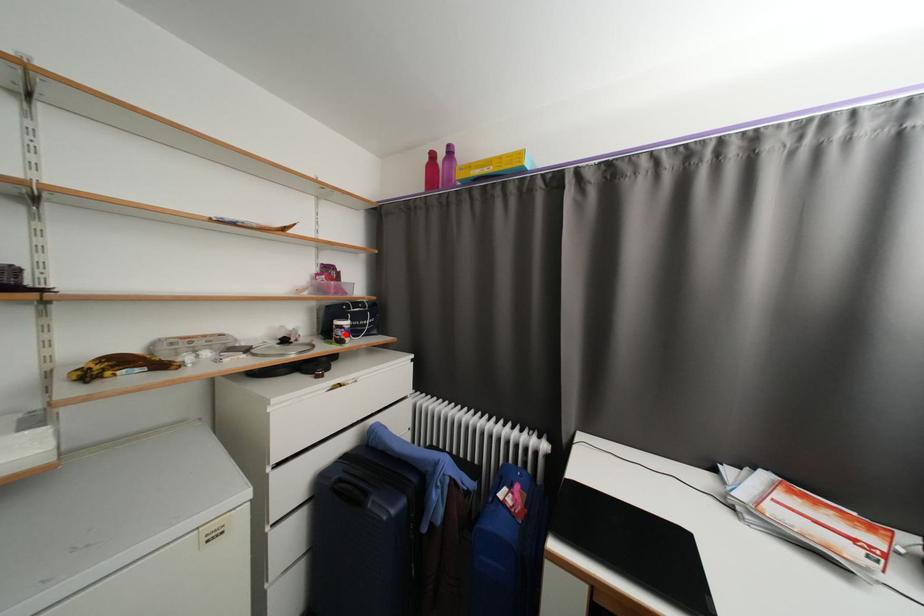
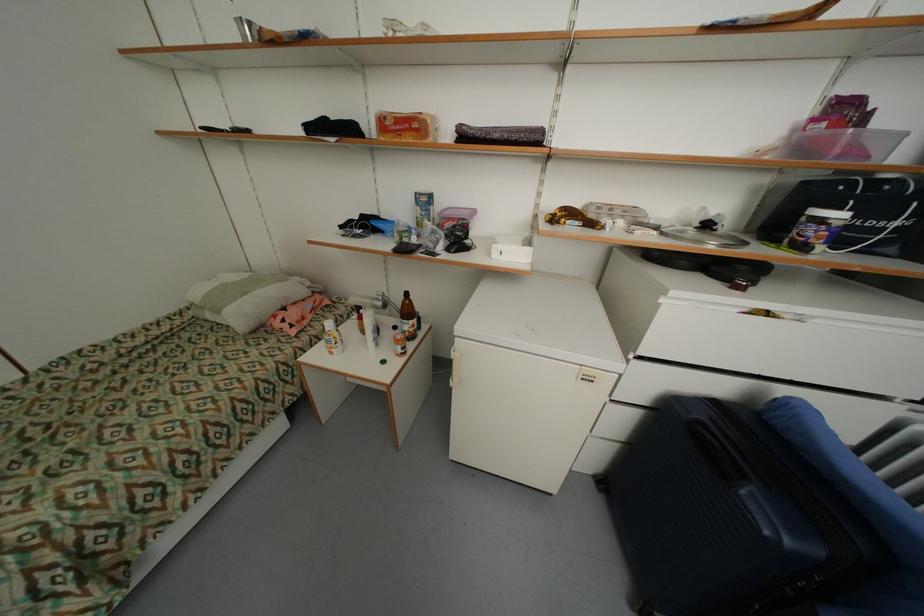
The point at the highlighted location is marked in the first image. Where is the corresponding point in the second image?

(819, 233)